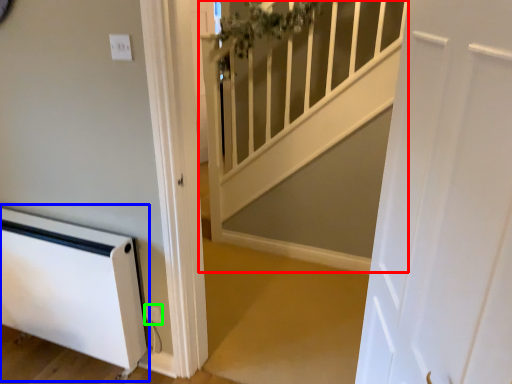
Question: Considering the real-world distances, which object is farthest from stairwell (highlighted by a red box)? appliance (highlighted by a blue box) or electric outlet (highlighted by a green box)?

Choices:
 (A) appliance
 (B) electric outlet

Answer: (B)